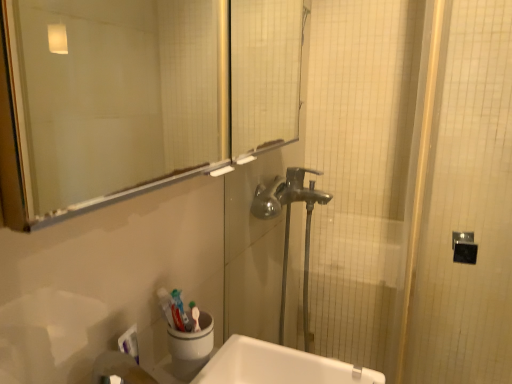
This screenshot has width=512, height=384. What do you see at coordinates (273, 366) in the screenshot? I see `white glossy sink at lower center` at bounding box center [273, 366].

Find the location of `white glossy sink at lower center`. white glossy sink at lower center is located at coordinates (273, 366).

From the image's perspective, which one is positioned higher, white glossy sink at lower center or polished chrome faucet at center?

From the image's view, polished chrome faucet at center is above.

Does point (279, 350) come behind point (307, 205)?

That is False.

Is white glossy sink at lower center to the left of polished chrome faucet at center from the viewer's perspective?

Yes, white glossy sink at lower center is to the left of polished chrome faucet at center.

Do you think white glossy sink at lower center is within polished chrome faucet at center, or outside of it?

white glossy sink at lower center is outside polished chrome faucet at center.

In terms of width, does transparent glass mirror at upper center look wider or thinner when compared to polished chrome faucet at center?

Clearly, transparent glass mirror at upper center has more width compared to polished chrome faucet at center.

Is polished chrome faucet at center at the back of transparent glass mirror at upper center?

transparent glass mirror at upper center is not turned away from polished chrome faucet at center.

Is transparent glass mirror at upper center bigger or smaller than polished chrome faucet at center?

Clearly, transparent glass mirror at upper center is smaller in size than polished chrome faucet at center.

Who is taller, polished chrome faucet at center or transparent glass mirror at upper center?

polished chrome faucet at center.

From a real-world perspective, is polished chrome faucet at center above or below transparent glass mirror at upper center?

polished chrome faucet at center is below transparent glass mirror at upper center.

From the picture: Is transparent glass mirror at upper center located within polished chrome faucet at center?

No, transparent glass mirror at upper center is not inside polished chrome faucet at center.

Can you tell me how much polished chrome faucet at center and transparent glass mirror at upper center differ in facing direction?

0.81 degrees separate the facing orientations of polished chrome faucet at center and transparent glass mirror at upper center.

Is polished chrome faucet at center looking in the opposite direction of white glossy sink at lower center?

No, white glossy sink at lower center is not at the back of polished chrome faucet at center.

Would you say polished chrome faucet at center is inside or outside white glossy sink at lower center?

The correct answer is: outside.

Which is behind, polished chrome faucet at center or white glossy sink at lower center?

polished chrome faucet at center is more distant.

From a real-world perspective, is polished chrome faucet at center positioned under white glossy sink at lower center based on gravity?

Yes, from a real-world perspective, polished chrome faucet at center is under white glossy sink at lower center.

Is transparent glass mirror at upper center far away from white glossy sink at lower center?

Actually, transparent glass mirror at upper center and white glossy sink at lower center are a little close together.

Considering the relative positions of transparent glass mirror at upper center and white glossy sink at lower center in the image provided, is transparent glass mirror at upper center to the right of white glossy sink at lower center from the viewer's perspective?

No.

Considering the relative sizes of transparent glass mirror at upper center and white glossy sink at lower center in the image provided, is transparent glass mirror at upper center taller than white glossy sink at lower center?

Indeed, transparent glass mirror at upper center has a greater height compared to white glossy sink at lower center.

I want to click on sink that appears below the transparent glass mirror at upper center (from the image's perspective), so click(x=273, y=366).

Would you say transparent glass mirror at upper center is part of white glossy sink at lower center's contents?

No, transparent glass mirror at upper center is not a part of white glossy sink at lower center.

Is white glossy sink at lower center facing away from transparent glass mirror at upper center?

No.

Does white glossy sink at lower center have a smaller size compared to transparent glass mirror at upper center?

Indeed, white glossy sink at lower center has a smaller size compared to transparent glass mirror at upper center.

In terms of width, does white glossy sink at lower center look wider or thinner when compared to transparent glass mirror at upper center?

Considering their sizes, white glossy sink at lower center looks broader than transparent glass mirror at upper center.

The width and height of the screenshot is (512, 384). Identify the location of sink on the left of polished chrome faucet at center. (273, 366).

What are the coordinates of `plumbing fixture lying on the right of transparent glass mirror at upper center` in the screenshot? It's located at (289, 226).

Estimate the real-world distances between objects in this image. Which object is further from white glossy sink at lower center, transparent glass mirror at upper center or polished chrome faucet at center?

Based on the image, transparent glass mirror at upper center appears to be further to white glossy sink at lower center.

Considering their positions, is polished chrome faucet at center positioned closer to transparent glass mirror at upper center than white glossy sink at lower center?

Based on the image, polished chrome faucet at center appears to be nearer to transparent glass mirror at upper center.

Considering their positions, is transparent glass mirror at upper center positioned closer to polished chrome faucet at center than white glossy sink at lower center?

white glossy sink at lower center.

Estimate the real-world distances between objects in this image. Which object is further from polished chrome faucet at center, white glossy sink at lower center or transparent glass mirror at upper center?

transparent glass mirror at upper center is positioned further to the anchor polished chrome faucet at center.

Based on their spatial positions, is polished chrome faucet at center or transparent glass mirror at upper center closer to white glossy sink at lower center?

Based on the image, polished chrome faucet at center appears to be nearer to white glossy sink at lower center.

Which object lies further to the anchor point transparent glass mirror at upper center, white glossy sink at lower center or polished chrome faucet at center?

Based on the image, white glossy sink at lower center appears to be further to transparent glass mirror at upper center.

Image resolution: width=512 pixels, height=384 pixels. What are the coordinates of `sink positioned between transparent glass mirror at upper center and polished chrome faucet at center from near to far` in the screenshot? It's located at (273, 366).